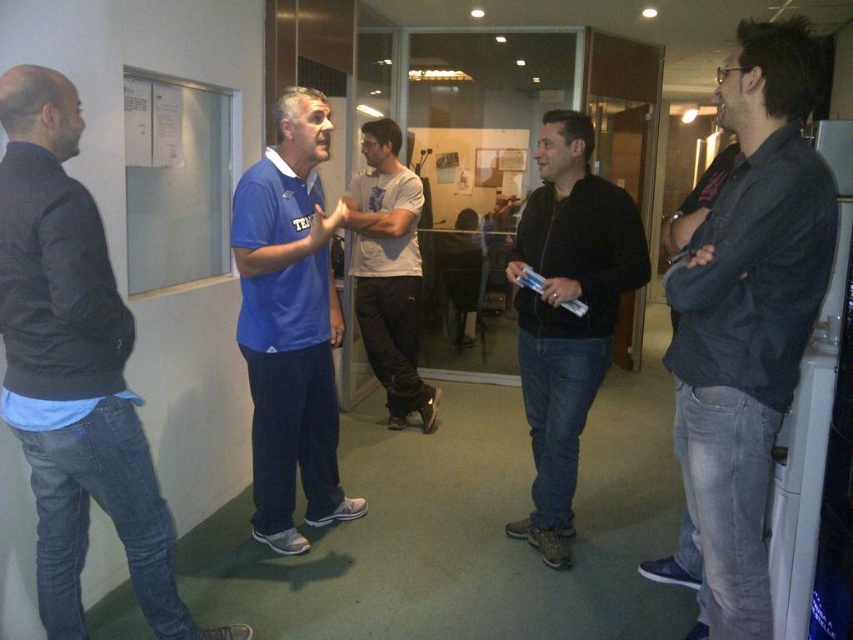
You are standing at the position of the man in the dark jacket and light blue shirt on the left. You need to point to the point that is closer to you. Which point should you choose between point [248,305] and point [367,148]?

Point [248,305] is in front of point [367,148], so you should choose point [248,305] as it is closer to you.

You are standing at the camera position and want to know the exact coordinates of the blue matte shirt at center. What are its coordinates?

The blue matte shirt at center is located at coordinates point (289, 324).